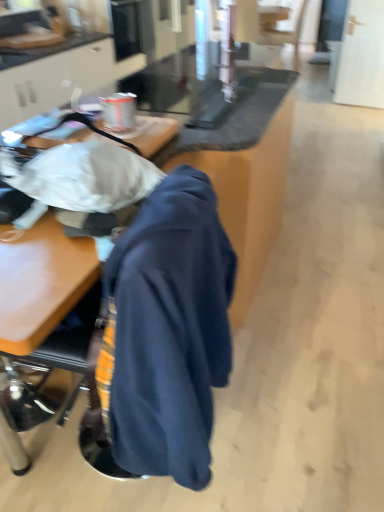
Identify the location of wooden table at center. This screenshot has width=384, height=512. (249, 191).

This screenshot has width=384, height=512. I want to click on black leather swivel chair at upper right, so click(281, 30).

Measure the distance between dark blue fabric at center and camera.

dark blue fabric at center is 33.93 inches from camera.

Locate an element on the screen. navy blue hoodie at center is located at coordinates (167, 331).

Which object is closer to the camera taking this photo, navy blue hoodie at center or black leather swivel chair at upper right?

navy blue hoodie at center is closer to the camera.

Is point (117, 254) closer or farther from the camera than point (282, 44)?

Clearly, point (117, 254) is closer to the camera than point (282, 44).

From a real-world perspective, which object rests below the other?

black leather swivel chair at upper right is physically lower.

How much distance is there between dark blue fabric at center and navy blue hoodie at center?

The distance of dark blue fabric at center from navy blue hoodie at center is 10.08 inches.

Who is taller, dark blue fabric at center or navy blue hoodie at center?

dark blue fabric at center.

You are a GUI agent. You are given a task and a screenshot of the screen. Output one action in this format:
    pyautogui.click(x=<x>, y=<y>)
    Task: Click on the desk behind the navy blue hoodie at center
    The image size is (384, 512).
    Given the screenshot: What is the action you would take?
    pyautogui.click(x=57, y=287)

Is wooden table at center next to navy blue hoodie at center and touching it?

No, wooden table at center is not making contact with navy blue hoodie at center.

Who is taller, wooden table at center or navy blue hoodie at center?

wooden table at center is taller.

Which object is further away from the camera, wooden table at center or navy blue hoodie at center?

wooden table at center is more distant.

How far apart are navy blue hoodie at center and wooden table at center?

The distance of navy blue hoodie at center from wooden table at center is 58.70 centimeters.

From a real-world perspective, is navy blue hoodie at center positioned above or below wooden table at center?

Clearly, from a real-world perspective, navy blue hoodie at center is above wooden table at center.

Which of these two, navy blue hoodie at center or wooden table at center, stands shorter?

Standing shorter between the two is navy blue hoodie at center.

What are the coordinates of `cloak on the left side of wooden table at center` in the screenshot? It's located at (167, 331).

Based on their sizes in the image, would you say wooden table at center is bigger or smaller than black leather swivel chair at upper right?

In the image, wooden table at center appears to be larger than black leather swivel chair at upper right.

Is wooden table at center situated inside black leather swivel chair at upper right or outside?

wooden table at center is spatially situated outside black leather swivel chair at upper right.

Can you confirm if wooden table at center is positioned to the right of black leather swivel chair at upper right?

No.

Considering the positions of objects navy blue hoodie at center and dark blue fabric at center in the image provided, who is more to the right, navy blue hoodie at center or dark blue fabric at center?

From the viewer's perspective, navy blue hoodie at center appears more on the right side.

Is navy blue hoodie at center facing towards dark blue fabric at center?

Yes, navy blue hoodie at center is oriented towards dark blue fabric at center.

Considering the points (114, 302) and (34, 400), which point is behind, point (114, 302) or point (34, 400)?

Point (34, 400)

Between navy blue hoodie at center and dark blue fabric at center, which one has larger size?

Bigger between the two is dark blue fabric at center.

This screenshot has width=384, height=512. I want to click on swivel chair above the navy blue hoodie at center (from the image's perspective), so click(281, 30).

Does black leather swivel chair at upper right have a greater height compared to navy blue hoodie at center?

Yes.

Is black leather swivel chair at upper right situated inside navy blue hoodie at center or outside?

black leather swivel chair at upper right is spatially situated outside navy blue hoodie at center.

Consider the image. From a real-world perspective, which is physically below, black leather swivel chair at upper right or navy blue hoodie at center?

black leather swivel chair at upper right.

Locate an element on the screen. This screenshot has height=512, width=384. cloak to the left of black leather swivel chair at upper right is located at coordinates (167, 331).

Locate an element on the screen. The image size is (384, 512). cloak located in front of the dark blue fabric at center is located at coordinates (167, 331).

When comparing their distances from black leather swivel chair at upper right, does dark blue fabric at center or wooden table at center seem further?

Among the two, dark blue fabric at center is located further to black leather swivel chair at upper right.

Estimate the real-world distances between objects in this image. Which object is further from navy blue hoodie at center, dark blue fabric at center or wooden table at center?

wooden table at center is positioned further to the anchor navy blue hoodie at center.

Estimate the real-world distances between objects in this image. Which object is closer to wooden table at center, dark blue fabric at center or navy blue hoodie at center?

The object closer to wooden table at center is navy blue hoodie at center.

In the scene shown: Considering their positions, is wooden table at center positioned closer to navy blue hoodie at center than black leather swivel chair at upper right?

The object closer to navy blue hoodie at center is wooden table at center.

When comparing their distances from wooden table at center, does navy blue hoodie at center or dark blue fabric at center seem closer?

Among the two, navy blue hoodie at center is located nearer to wooden table at center.

Which object lies further to the anchor point wooden table at center, navy blue hoodie at center or black leather swivel chair at upper right?

The object further to wooden table at center is black leather swivel chair at upper right.

Based on their spatial positions, is black leather swivel chair at upper right or wooden table at center further from navy blue hoodie at center?

Among the two, black leather swivel chair at upper right is located further to navy blue hoodie at center.

Estimate the real-world distances between objects in this image. Which object is closer to black leather swivel chair at upper right, wooden table at center or navy blue hoodie at center?

wooden table at center is closer to black leather swivel chair at upper right.

Locate an element on the screen. cloak between wooden table at center and dark blue fabric at center in the vertical direction is located at coordinates (167, 331).

I want to click on table between dark blue fabric at center and black leather swivel chair at upper right from front to back, so pos(249,191).

What are the coordinates of `desk located between navy blue hoodie at center and black leather swivel chair at upper right in the depth direction` in the screenshot? It's located at (57, 287).

The height and width of the screenshot is (512, 384). I want to click on table between navy blue hoodie at center and black leather swivel chair at upper right from front to back, so click(x=249, y=191).